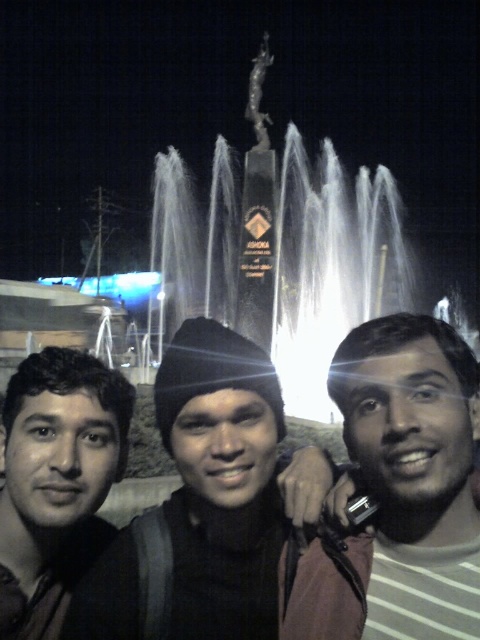
Which is more to the left, smooth black jacket at center or matte black face at left?

Positioned to the left is matte black face at left.

Is point (383, 593) positioned after point (72, 369)?

No, it is in front of (72, 369).

The image size is (480, 640). I want to click on smooth black jacket at center, so click(x=399, y=492).

Identify the location of smooth black jacket at center. (399, 492).

Is dark knit cap at center to the right of matte black face at left from the viewer's perspective?

Yes, dark knit cap at center is to the right of matte black face at left.

This screenshot has width=480, height=640. What do you see at coordinates (241, 504) in the screenshot?
I see `dark knit cap at center` at bounding box center [241, 504].

This screenshot has width=480, height=640. In order to click on dark knit cap at center in this screenshot , I will do [x=241, y=504].

Is the position of dark knit cap at center more distant than that of silver metallic statue at upper center?

No.

Is dark knit cap at center below silver metallic statue at upper center?

Correct, dark knit cap at center is located below silver metallic statue at upper center.

The image size is (480, 640). I want to click on dark knit cap at center, so (241, 504).

At what (x,y) coordinates should I click in order to perform the action: click on dark knit cap at center. Please return your answer as a coordinate pair (x, y). This screenshot has width=480, height=640. Looking at the image, I should click on (241, 504).